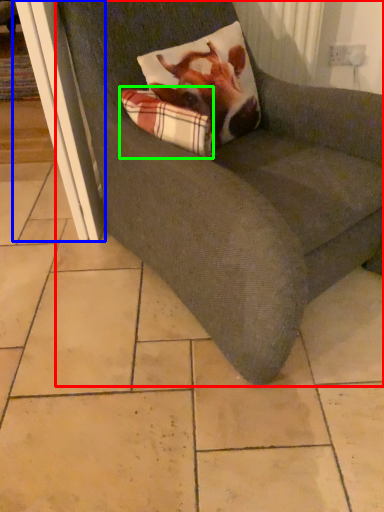
Question: Based on their relative distances, which object is nearer to chair (highlighted by a red box)? Choose from screen door (highlighted by a blue box) and plaid (highlighted by a green box).

Choices:
 (A) screen door
 (B) plaid

Answer: (B)